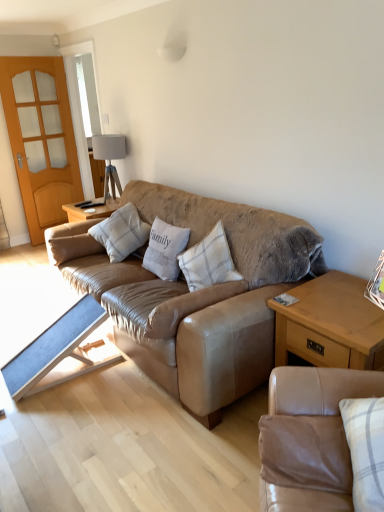
Question: From the image's perspective, does leather couch at center, the 1th studio couch viewed from the back, appear higher than tan leather couch at lower right, the first studio couch positioned from the front?

Choices:
 (A) yes
 (B) no

Answer: (A)

Question: Does leather couch at center, the 2th studio couch viewed from the front, have a greater height compared to tan leather couch at lower right, positioned as the first studio couch in bottom-to-top order?

Choices:
 (A) yes
 (B) no

Answer: (A)

Question: Is tan leather couch at lower right, positioned as the first studio couch in bottom-to-top order, completely or partially inside leather couch at center, the 1th studio couch viewed from the back?

Choices:
 (A) yes
 (B) no

Answer: (B)

Question: Is the depth of leather couch at center, the first studio couch positioned from the top, less than that of tan leather couch at lower right, the second studio couch when ordered from top to bottom?

Choices:
 (A) yes
 (B) no

Answer: (B)

Question: Can you confirm if leather couch at center, the 2th studio couch viewed from the front, is shorter than tan leather couch at lower right, the first studio couch positioned from the front?

Choices:
 (A) yes
 (B) no

Answer: (B)

Question: From a real-world perspective, is plaid fabric pillow at center, which ranks as the third pillow in right-to-left order, above or below blue fabric table at lower left, which appears as the 2th table when viewed from the right?

Choices:
 (A) above
 (B) below

Answer: (A)

Question: From the image's perspective, is plaid fabric pillow at center, the 2th pillow positioned from the left, above or below blue fabric table at lower left, which appears as the 2th table when viewed from the right?

Choices:
 (A) below
 (B) above

Answer: (B)

Question: Visually, is plaid fabric pillow at center, the 2th pillow positioned from the left, positioned to the left or to the right of blue fabric table at lower left, which appears as the 2th table when viewed from the right?

Choices:
 (A) right
 (B) left

Answer: (A)

Question: Is plaid fabric pillow at center, which ranks as the third pillow in right-to-left order, inside or outside of blue fabric table at lower left, which appears as the 2th table when viewed from the right?

Choices:
 (A) outside
 (B) inside

Answer: (A)

Question: Does point (130, 266) appear closer or farther from the camera than point (188, 259)?

Choices:
 (A) closer
 (B) farther

Answer: (B)

Question: From a real-world perspective, relative to plaid fabric pillow at center, which ranks as the first pillow in right-to-left order, is leather couch at center, the 2th studio couch positioned from the bottom, vertically above or below?

Choices:
 (A) below
 (B) above

Answer: (A)

Question: Is leather couch at center, the 2th studio couch viewed from the front, spatially inside plaid fabric pillow at center, placed as the 4th pillow when sorted from left to right, or outside of it?

Choices:
 (A) inside
 (B) outside

Answer: (B)

Question: Looking at their shapes, would you say leather couch at center, the first studio couch positioned from the top, is wider or thinner than plaid fabric pillow at center, which ranks as the first pillow in right-to-left order?

Choices:
 (A) thin
 (B) wide

Answer: (B)

Question: Is light wood/texture side table at lower right, which is the 2th table from left to right, wider or thinner than light brown wooden screen door at left?

Choices:
 (A) thin
 (B) wide

Answer: (B)

Question: In terms of size, does light wood/texture side table at lower right, which is the 2th table from left to right, appear bigger or smaller than light brown wooden screen door at left?

Choices:
 (A) big
 (B) small

Answer: (A)